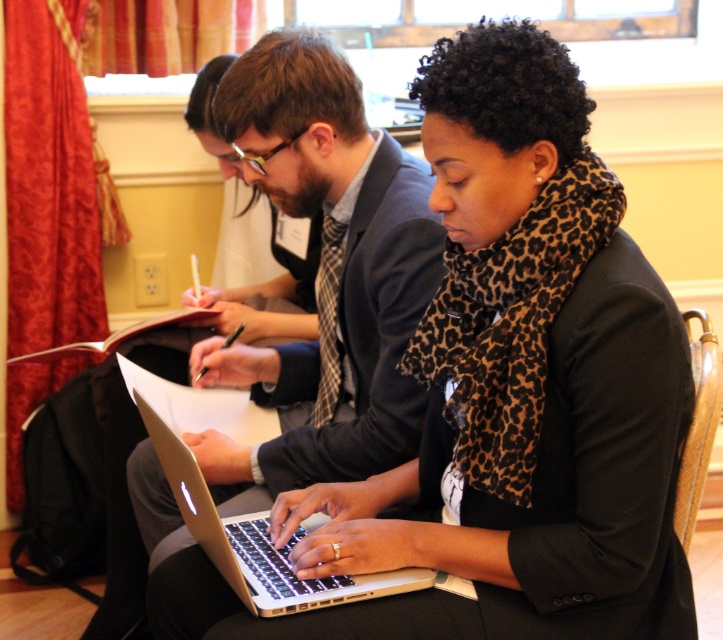
Question: Does matte black laptop at center appear over silver metallic laptop at center?

Choices:
 (A) yes
 (B) no

Answer: (A)

Question: Does matte black laptop at center appear over silver metallic laptop at center?

Choices:
 (A) no
 (B) yes

Answer: (B)

Question: Which of the following is the closest to the observer?

Choices:
 (A) (273, 432)
 (B) (504, 432)

Answer: (B)

Question: Does matte black laptop at center appear over silver metallic laptop at center?

Choices:
 (A) no
 (B) yes

Answer: (B)

Question: Among these objects, which one is farthest from the camera?

Choices:
 (A) silver metallic laptop at center
 (B) matte black laptop at center

Answer: (A)